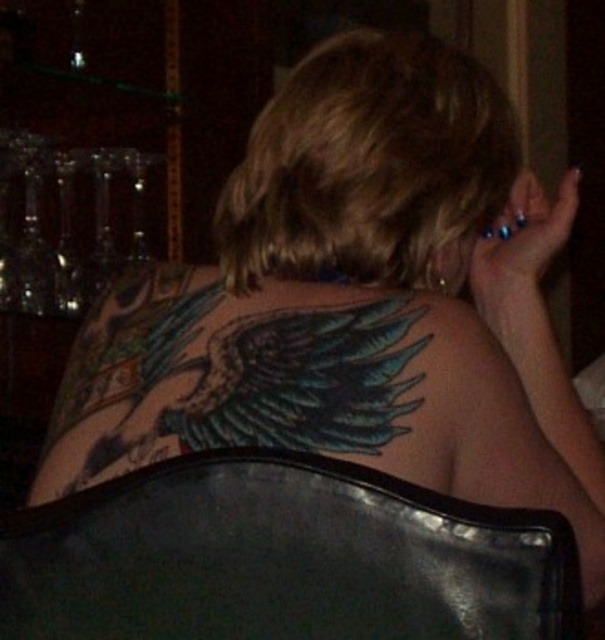
You are standing in a dimly lit bar or restaurant and want to reach the point at coordinates (255, 618). The distance between you and this point is 21.65 inches. Can you comfortably reach it with your outstretched hand?

The point at coordinates (255, 618) is 21.65 inches away from you. Since the average human arm length is about 25 inches, you can comfortably reach it with your outstretched hand.

You are a photographer setting up a shoot in this dimly lit bar. You need to position a light source to highlight both the black leather chair at lower center and the colorful ink wings at upper back. Given their sizes, which object requires a larger light source to adequately illuminate it?

The colorful ink wings at upper back require a larger light source because they are bigger in size compared to the black leather chair at lower center.

Based on the scene description, what object is located at the coordinate point (281, 557)?

The black leather chair at lower center is located at the coordinate point (281, 557).